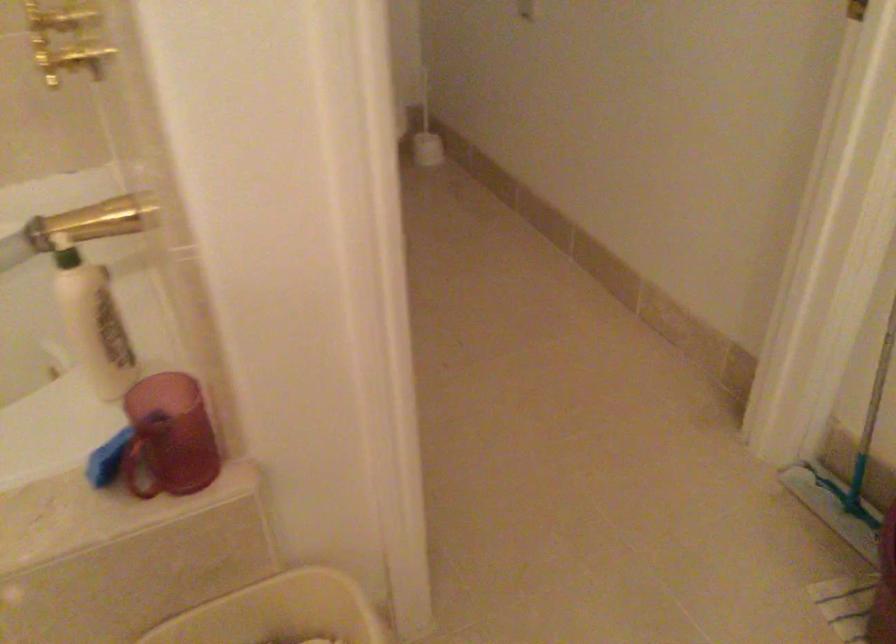
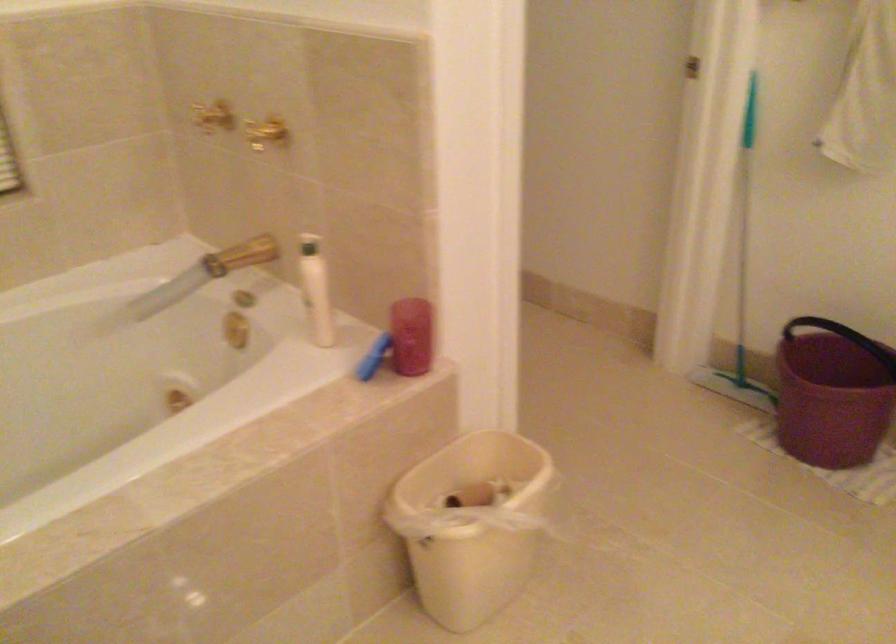
Where in the second image is the point corresponding to point 87,225 from the first image?

(240, 254)